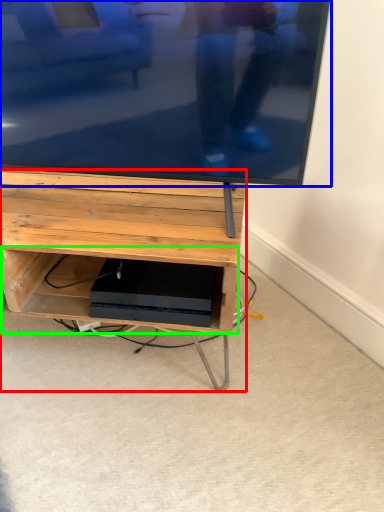
Question: Considering the real-world distances, which object is closest to furniture (highlighted by a red box)? television (highlighted by a blue box) or shelf (highlighted by a green box).

Choices:
 (A) television
 (B) shelf

Answer: (B)